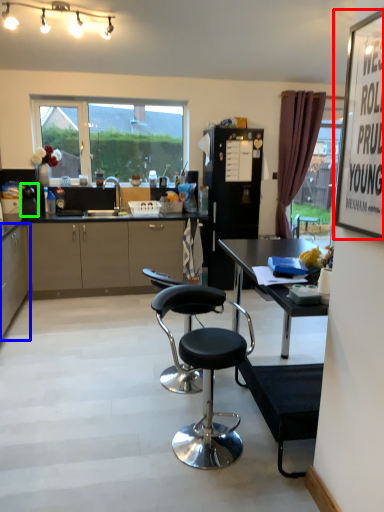
Question: Considering the real-world distances, which object is farthest from bulletin board (highlighted by a red box)? cabinetry (highlighted by a blue box) or appliance (highlighted by a green box)?

Choices:
 (A) cabinetry
 (B) appliance

Answer: (B)